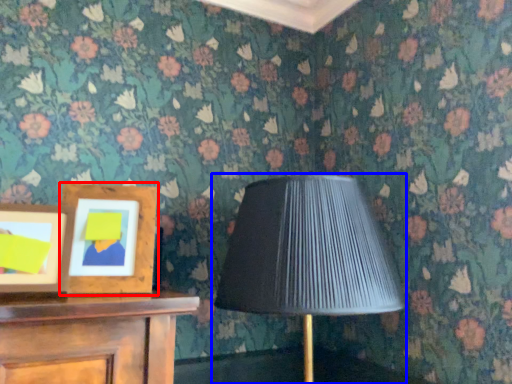
Question: Among these objects, which one is nearest to the camera, picture frame (highlighted by a red box) or lamp (highlighted by a blue box)?

Choices:
 (A) picture frame
 (B) lamp

Answer: (B)